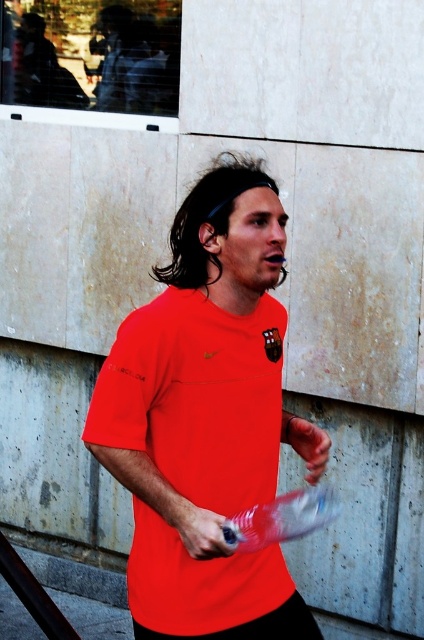
Question: Is matte red shirt at center further to camera compared to smooth skin hand at center?

Choices:
 (A) yes
 (B) no

Answer: (B)

Question: Can you confirm if matte red shirt at center is wider than transparent plastic bottle at center?

Choices:
 (A) yes
 (B) no

Answer: (A)

Question: Which point appears farthest from the camera in this image?

Choices:
 (A) (200, 513)
 (B) (295, 419)

Answer: (B)

Question: Does matte red shirt at center lie behind transparent plastic bottle at center?

Choices:
 (A) yes
 (B) no

Answer: (A)

Question: Which point is farther from the camera taking this photo?

Choices:
 (A) (203, 520)
 (B) (281, 433)

Answer: (B)

Question: Which of these objects is positioned farthest from the transparent plastic bottle at center?

Choices:
 (A) smooth skin hand at center
 (B) matte red shirt at center
 (C) matte plastic bottle at center

Answer: (B)